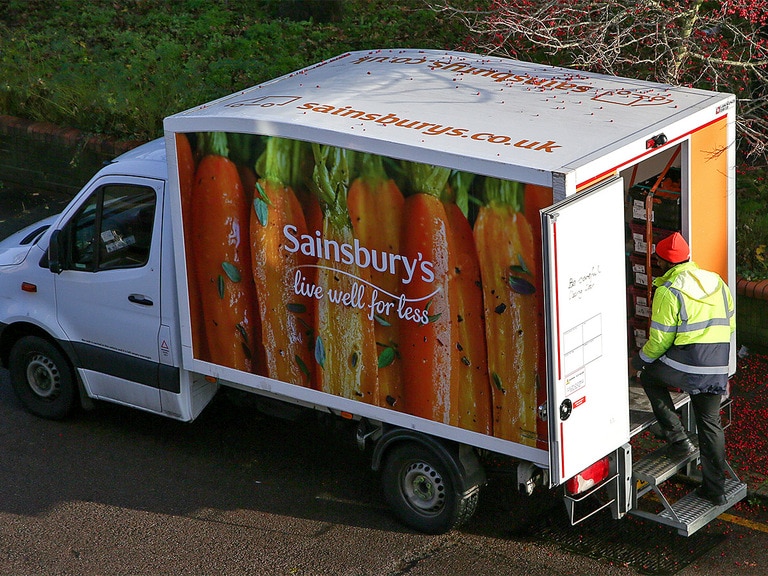
The image size is (768, 576). I want to click on light, so (31, 287).